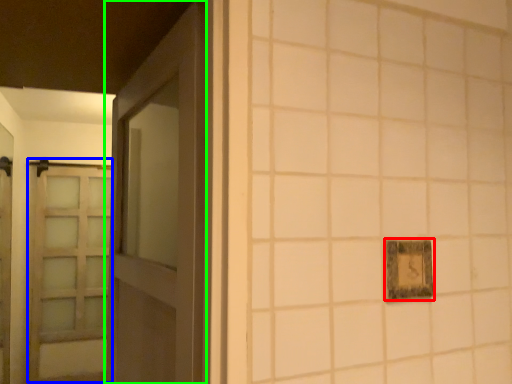
Question: Estimate the real-world distances between objects in this image. Which object is farther from picture frame (highlighted by a red box), barn door (highlighted by a blue box) or door (highlighted by a green box)?

Choices:
 (A) barn door
 (B) door

Answer: (A)